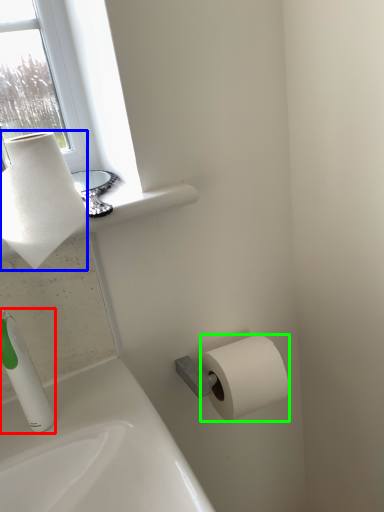
Question: Which is farther away from soap dispenser (highlighted by a red box)? paper towel (highlighted by a blue box) or toilet paper (highlighted by a green box)?

Choices:
 (A) paper towel
 (B) toilet paper

Answer: (B)